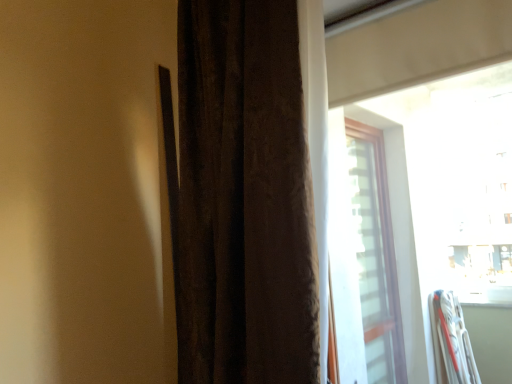
The height and width of the screenshot is (384, 512). In order to click on brown textured curtain at center in this screenshot , I will do `click(244, 198)`.

This screenshot has width=512, height=384. What do you see at coordinates (244, 198) in the screenshot? I see `brown textured curtain at center` at bounding box center [244, 198].

Where is `transparent glass window at upper right`? This screenshot has width=512, height=384. transparent glass window at upper right is located at coordinates (424, 169).

What do you see at coordinates (424, 169) in the screenshot? I see `transparent glass window at upper right` at bounding box center [424, 169].

This screenshot has height=384, width=512. Find the location of `brown textured curtain at center`. brown textured curtain at center is located at coordinates (244, 198).

From the picture: Considering the positions of objects transparent glass window at upper right and brown textured curtain at center in the image provided, who is more to the right, transparent glass window at upper right or brown textured curtain at center?

A: transparent glass window at upper right.

Is transparent glass window at upper right closer to camera compared to brown textured curtain at center?

Yes, it is.

Considering the positions of points (404, 190) and (263, 6), is point (404, 190) closer to camera compared to point (263, 6)?

No, it is behind (263, 6).

From the image's perspective, relative to brown textured curtain at center, is transparent glass window at upper right above or below?

From the image's perspective, transparent glass window at upper right appears below brown textured curtain at center.

From a real-world perspective, relative to brown textured curtain at center, is transparent glass window at upper right vertically above or below?

Clearly, from a real-world perspective, transparent glass window at upper right is below brown textured curtain at center.

Which object is thinner, transparent glass window at upper right or brown textured curtain at center?

transparent glass window at upper right.

Considering the relative sizes of transparent glass window at upper right and brown textured curtain at center in the image provided, is transparent glass window at upper right shorter than brown textured curtain at center?

Indeed, transparent glass window at upper right has a lesser height compared to brown textured curtain at center.

Is transparent glass window at upper right bigger or smaller than brown textured curtain at center?

In the image, transparent glass window at upper right appears to be smaller than brown textured curtain at center.

Is brown textured curtain at center a part of transparent glass window at upper right?

No.

In the scene shown: Would you consider transparent glass window at upper right to be distant from brown textured curtain at center?

Indeed, transparent glass window at upper right is not near brown textured curtain at center.

Does transparent glass window at upper right turn towards brown textured curtain at center?

No, transparent glass window at upper right is not aimed at brown textured curtain at center.

How different are the orientations of transparent glass window at upper right and brown textured curtain at center in degrees?

They differ by 0.618 degrees in their facing directions.

I want to click on curtain above the transparent glass window at upper right (from a real-world perspective), so click(244, 198).

Which is more to the left, brown textured curtain at center or transparent glass window at upper right?

brown textured curtain at center is more to the left.

Considering the positions of objects brown textured curtain at center and transparent glass window at upper right in the image provided, who is behind, brown textured curtain at center or transparent glass window at upper right?

brown textured curtain at center is more distant.

Which is farther from the camera, (193, 71) or (495, 82)?

The point (495, 82) is farther.

From the image's perspective, which one is positioned higher, brown textured curtain at center or transparent glass window at upper right?

brown textured curtain at center, from the image's perspective.

From a real-world perspective, between brown textured curtain at center and transparent glass window at upper right, who is vertically higher?

brown textured curtain at center is physically above.

Is brown textured curtain at center thinner than transparent glass window at upper right?

In fact, brown textured curtain at center might be wider than transparent glass window at upper right.

Considering the sizes of objects brown textured curtain at center and transparent glass window at upper right in the image provided, who is taller, brown textured curtain at center or transparent glass window at upper right?

brown textured curtain at center is taller.

Between brown textured curtain at center and transparent glass window at upper right, which one has larger size?

With larger size is brown textured curtain at center.

Is brown textured curtain at center inside or outside of transparent glass window at upper right?

brown textured curtain at center exists outside the volume of transparent glass window at upper right.

Are brown textured curtain at center and transparent glass window at upper right located far from each other?

Yes, brown textured curtain at center and transparent glass window at upper right are located far from each other.

Could you tell me if brown textured curtain at center is turned towards transparent glass window at upper right?

No, brown textured curtain at center does not turn towards transparent glass window at upper right.

Locate an element on the screen. curtain above the transparent glass window at upper right (from a real-world perspective) is located at coordinates (244, 198).

The height and width of the screenshot is (384, 512). I want to click on curtain located above the transparent glass window at upper right (from a real-world perspective), so click(x=244, y=198).

You are a GUI agent. You are given a task and a screenshot of the screen. Output one action in this format:
    pyautogui.click(x=<x>, y=<y>)
    Task: Click on the curtain lying above the transparent glass window at upper right (from the image's perspective)
    The width and height of the screenshot is (512, 384).
    Given the screenshot: What is the action you would take?
    pyautogui.click(x=244, y=198)